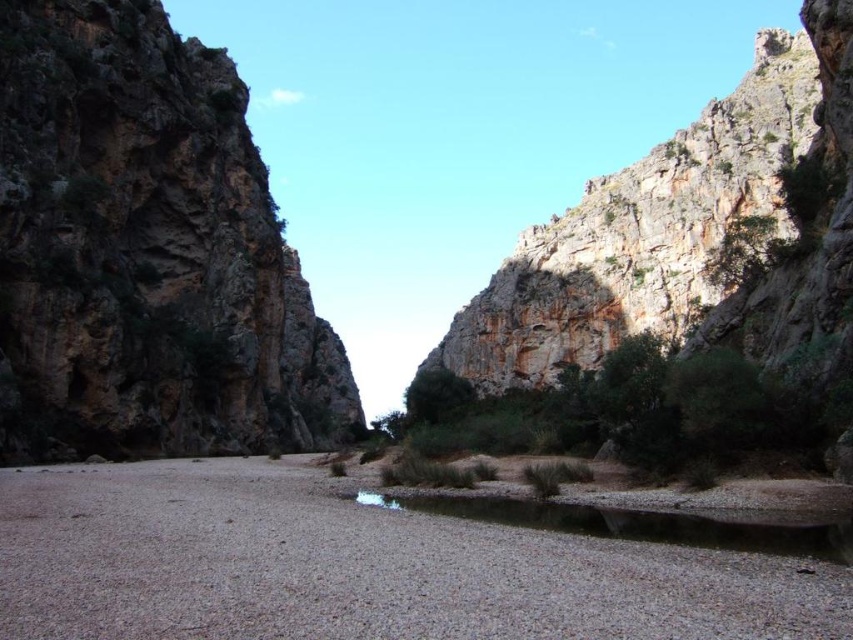
Question: Based on their relative distances, which object is farther from the gray gravel bed at center?

Choices:
 (A) clear gravel river at center
 (B) rugged rock mountain at upper right
 (C) rustic rock mountain at left

Answer: (B)

Question: Which point is closer to the camera?

Choices:
 (A) gray gravel bed at center
 (B) rugged rock mountain at upper right
 (C) clear gravel river at center
 (D) rustic rock mountain at left

Answer: (A)

Question: Which point is farther from the camera taking this photo?

Choices:
 (A) (538, 563)
 (B) (184, 180)
 (C) (361, 493)
 (D) (699, 259)

Answer: (D)

Question: Can you confirm if rustic rock mountain at left is smaller than clear gravel river at center?

Choices:
 (A) yes
 (B) no

Answer: (B)

Question: Is gray gravel bed at center to the right of clear gravel river at center from the viewer's perspective?

Choices:
 (A) no
 (B) yes

Answer: (A)

Question: Does rustic rock mountain at left have a smaller size compared to rugged rock mountain at upper right?

Choices:
 (A) yes
 (B) no

Answer: (A)